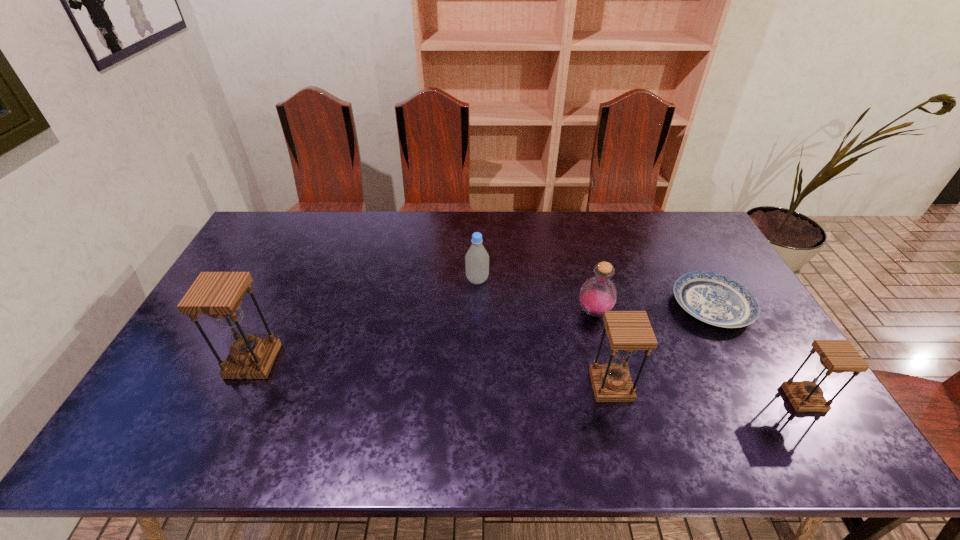
Please mark a free spot for a new hourglass to balance the arrangement. Please provide its 2D coordinates. Your answer should be formatted as a tuple, i.e. [(x, y)], where the tuple contains the x and y coordinates of a point satisfying the conditions above.

[(428, 373)]